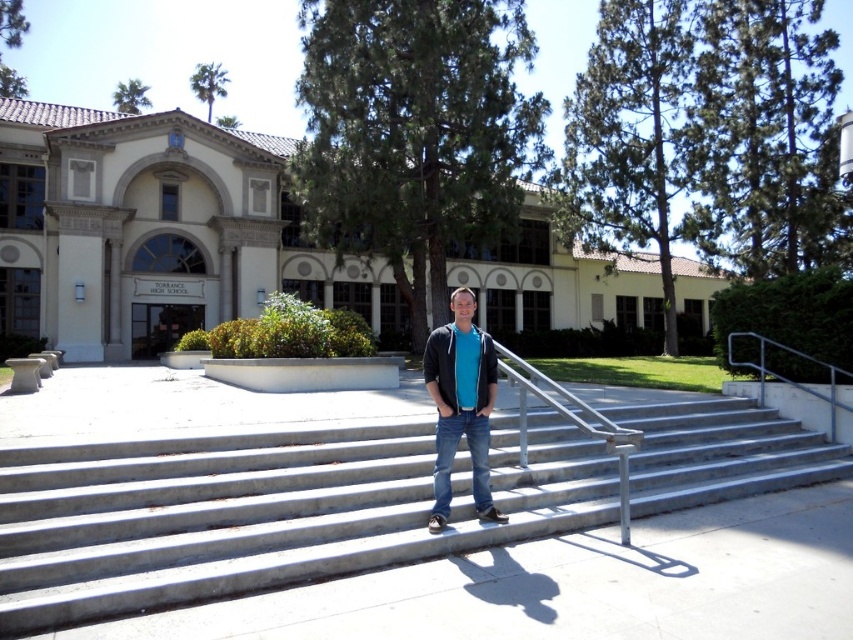
You are a photographer trying to capture the person standing on the concrete stairs at center. The point you need to focus on is point (263, 513). Where exactly is this point located?

The point (263, 513) is located on the concrete stairs at center where the person is standing.

You are designing a uniform for Riverside High School and need to ensure that the new uniform fits properly. Given that the matte blue shirt at center is wider than the silver metallic handrail at upper right, which object would you use as a reference for measuring the standard width of the uniform?

The matte blue shirt at center is wider than the silver metallic handrail at upper right, so you should use the matte blue shirt at center as the reference for measuring the standard width of the uniform.

You are a photographer trying to capture the person standing on the concrete stairs at center and the blue denim jeans at center. Since you want to ensure both are fully visible in the frame, which object is wider and should be positioned first in your composition?

The concrete stairs at center are wider than the blue denim jeans at center, so you should position the concrete stairs at center first in your composition to ensure both fit within the frame.